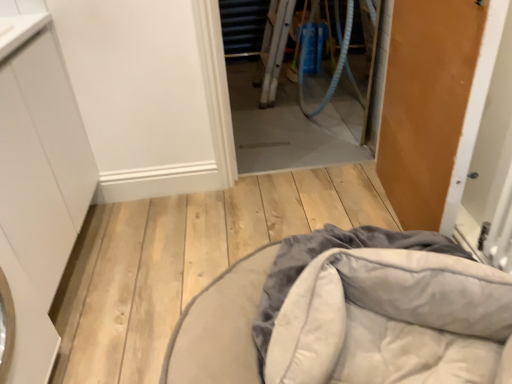
Describe the element at coordinates (297, 89) in the screenshot. Image resolution: width=512 pixels, height=384 pixels. I see `transparent plastic screen door at center` at that location.

The image size is (512, 384). What do you see at coordinates (336, 66) in the screenshot?
I see `blue rubber garden hose at center` at bounding box center [336, 66].

Where is `velvet gray cushion at lower center`? This screenshot has height=384, width=512. velvet gray cushion at lower center is located at coordinates click(349, 314).

The image size is (512, 384). I want to click on transparent plastic screen door at center, so click(297, 89).

Is blue rubber garden hose at center behind velvet gray cushion at lower center?

Yes, blue rubber garden hose at center is further from the viewer.

Is blue rubber garden hose at center smaller than velvet gray cushion at lower center?

Actually, blue rubber garden hose at center might be larger than velvet gray cushion at lower center.

Does blue rubber garden hose at center appear on the right side of velvet gray cushion at lower center?

Correct, you'll find blue rubber garden hose at center to the right of velvet gray cushion at lower center.

Based on the photo, from the image's perspective, is wooden door at right located above transparent plastic screen door at center?

No, from the image's perspective, wooden door at right is not on top of transparent plastic screen door at center.

Considering the sizes of wooden door at right and transparent plastic screen door at center in the image, is wooden door at right wider or thinner than transparent plastic screen door at center?

Clearly, wooden door at right has less width compared to transparent plastic screen door at center.

Is wooden door at right positioned with its back to transparent plastic screen door at center?

No, wooden door at right is not facing the opposite direction of transparent plastic screen door at center.

Looking at this image, how much distance is there between wooden door at right and transparent plastic screen door at center?

wooden door at right is 3.91 feet from transparent plastic screen door at center.

Considering the relative sizes of blue rubber garden hose at center and transparent plastic screen door at center in the image provided, is blue rubber garden hose at center taller than transparent plastic screen door at center?

Yes.

Considering the sizes of blue rubber garden hose at center and transparent plastic screen door at center in the image, is blue rubber garden hose at center wider or thinner than transparent plastic screen door at center?

Clearly, blue rubber garden hose at center has more width compared to transparent plastic screen door at center.

Which is more to the right, blue rubber garden hose at center or transparent plastic screen door at center?

Positioned to the right is blue rubber garden hose at center.

Does blue rubber garden hose at center touch transparent plastic screen door at center?

No, blue rubber garden hose at center is not making contact with transparent plastic screen door at center.

Is velvet gray cushion at lower center next to blue rubber garden hose at center and touching it?

No, velvet gray cushion at lower center is not beside blue rubber garden hose at center.

From the picture: In the image, is velvet gray cushion at lower center positioned in front of or behind blue rubber garden hose at center?

velvet gray cushion at lower center is in front of blue rubber garden hose at center.

Does velvet gray cushion at lower center have a greater height compared to blue rubber garden hose at center?

No, velvet gray cushion at lower center is not taller than blue rubber garden hose at center.

From the image's perspective, which one is positioned lower, velvet gray cushion at lower center or blue rubber garden hose at center?

velvet gray cushion at lower center, from the image's perspective.

In the image, is transparent plastic screen door at center on the left side or the right side of white matte cabinet at left?

transparent plastic screen door at center is to the right of white matte cabinet at left.

In terms of size, does transparent plastic screen door at center appear bigger or smaller than white matte cabinet at left?

In the image, transparent plastic screen door at center appears to be smaller than white matte cabinet at left.

Would you consider transparent plastic screen door at center to be distant from white matte cabinet at left?

Absolutely, transparent plastic screen door at center is distant from white matte cabinet at left.

Is transparent plastic screen door at center in front of white matte cabinet at left?

No, the depth of transparent plastic screen door at center is greater than that of white matte cabinet at left.

Considering the relative positions of wooden door at right and white matte cabinet at left in the image provided, is wooden door at right to the right of white matte cabinet at left from the viewer's perspective?

Yes.

Which of these two, wooden door at right or white matte cabinet at left, stands shorter?

Standing shorter between the two is white matte cabinet at left.

Is wooden door at right completely or partially outside of white matte cabinet at left?

Yes, wooden door at right is located beyond the bounds of white matte cabinet at left.

Could you tell me if wooden door at right is turned towards white matte cabinet at left?

Yes, wooden door at right is facing white matte cabinet at left.

Between blue rubber garden hose at center and white matte cabinet at left, which one has less height?

Standing shorter between the two is white matte cabinet at left.

In terms of size, does blue rubber garden hose at center appear bigger or smaller than white matte cabinet at left?

In the image, blue rubber garden hose at center appears to be smaller than white matte cabinet at left.

Consider the image. Is blue rubber garden hose at center further to camera compared to white matte cabinet at left?

Yes, blue rubber garden hose at center is further from the viewer.

Does blue rubber garden hose at center appear on the left side of white matte cabinet at left?

No, blue rubber garden hose at center is not to the left of white matte cabinet at left.

This screenshot has width=512, height=384. What are the coordinates of `furniture below the blue rubber garden hose at center (from the image's perspective)` in the screenshot? It's located at (349, 314).

The width and height of the screenshot is (512, 384). What are the coordinates of `door on the right of transparent plastic screen door at center` in the screenshot? It's located at (426, 104).

Which object lies further to the anchor point velvet gray cushion at lower center, transparent plastic screen door at center or white matte cabinet at left?

Based on the image, transparent plastic screen door at center appears to be further to velvet gray cushion at lower center.

Estimate the real-world distances between objects in this image. Which object is closer to blue rubber garden hose at center, white matte cabinet at left or wooden door at right?

Based on the image, wooden door at right appears to be nearer to blue rubber garden hose at center.

Looking at the image, which one is located closer to velvet gray cushion at lower center, white matte cabinet at left or wooden door at right?

wooden door at right.

Estimate the real-world distances between objects in this image. Which object is closer to wooden door at right, transparent plastic screen door at center or white matte cabinet at left?

transparent plastic screen door at center is closer to wooden door at right.

Consider the image. Considering their positions, is velvet gray cushion at lower center positioned further to white matte cabinet at left than blue rubber garden hose at center?

blue rubber garden hose at center is positioned further to the anchor white matte cabinet at left.

Considering their positions, is velvet gray cushion at lower center positioned closer to white matte cabinet at left than transparent plastic screen door at center?

The object closer to white matte cabinet at left is velvet gray cushion at lower center.

Looking at the image, which one is located closer to blue rubber garden hose at center, velvet gray cushion at lower center or white matte cabinet at left?

The object closer to blue rubber garden hose at center is white matte cabinet at left.

Which object lies further to the anchor point transparent plastic screen door at center, wooden door at right or white matte cabinet at left?

white matte cabinet at left.

This screenshot has width=512, height=384. Find the location of `screen door located between wooden door at right and blue rubber garden hose at center in the depth direction`. screen door located between wooden door at right and blue rubber garden hose at center in the depth direction is located at coordinates (297, 89).

At what (x,y) coordinates should I click in order to perform the action: click on furniture between white matte cabinet at left and transparent plastic screen door at center. Please return your answer as a coordinate pair (x, y). Looking at the image, I should click on (349, 314).

Where is `garden hose situated between white matte cabinet at left and wooden door at right from left to right`? The height and width of the screenshot is (384, 512). garden hose situated between white matte cabinet at left and wooden door at right from left to right is located at coordinates (336, 66).

Identify the location of screen door between blue rubber garden hose at center and velvet gray cushion at lower center in the up-down direction. The width and height of the screenshot is (512, 384). (297, 89).